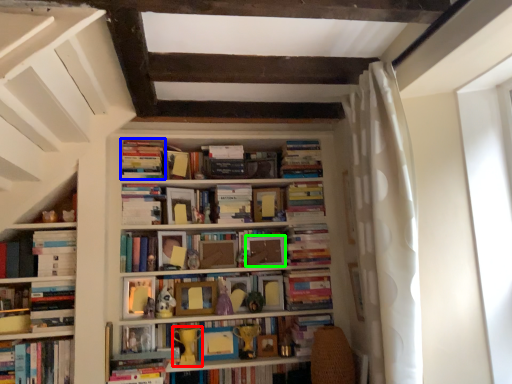
Question: Which is nearer to the toy (highlighted by a red box)? book (highlighted by a blue box) or paperback book (highlighted by a green box).

Choices:
 (A) book
 (B) paperback book

Answer: (B)